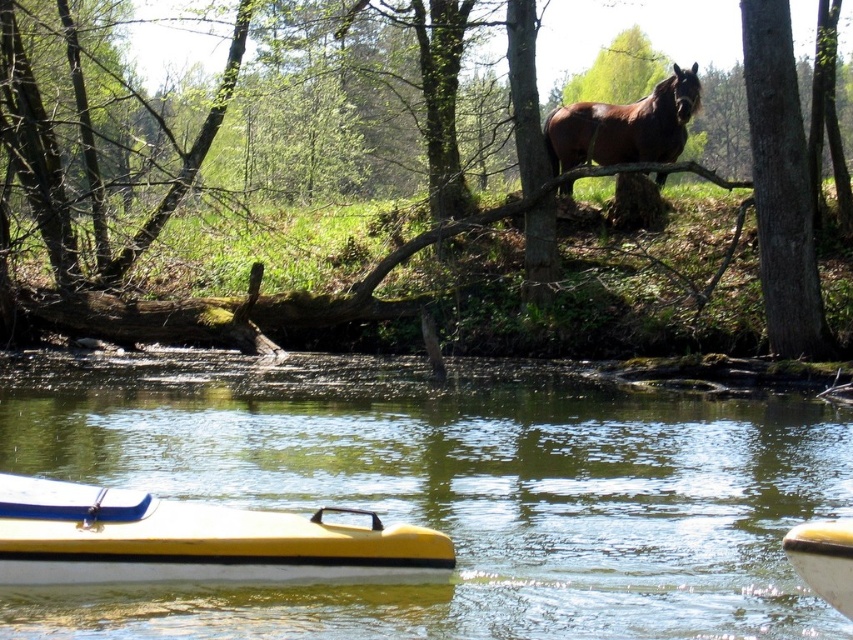
Looking at this image, who is shorter, brown wood tree at upper center or brown rough bark tree at upper right?

With less height is brown rough bark tree at upper right.

Who is higher up, brown wood tree at upper center or brown rough bark tree at upper right?

brown rough bark tree at upper right is above.

Measure the distance between point (241, 317) and camera.

30.04 meters

The image size is (853, 640). I want to click on brown wood tree at upper center, so click(x=637, y=172).

In the scene shown: Is clear water at lower center smaller than yellow plastic boat at lower right?

No.

Who is shorter, clear water at lower center or yellow plastic boat at lower right?

yellow plastic boat at lower right is shorter.

Identify the location of clear water at lower center. This screenshot has width=853, height=640. (445, 492).

Which is below, clear water at lower center or brown rough bark tree at upper right?

clear water at lower center is lower down.

Based on the photo, can you confirm if clear water at lower center is positioned to the left of brown rough bark tree at upper right?

Yes, clear water at lower center is to the left of brown rough bark tree at upper right.

Is point (619, 529) closer to camera compared to point (761, 161)?

Yes, it is in front of point (761, 161).

What are the coordinates of `clear water at lower center` in the screenshot? It's located at (445, 492).